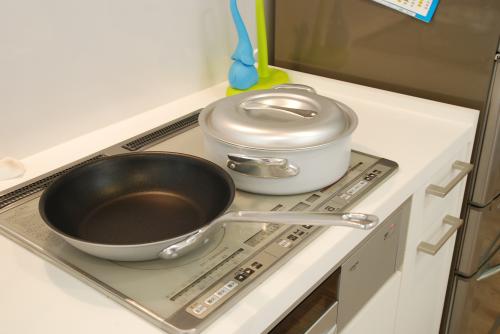
This screenshot has width=500, height=334. Identify the location of corner of a calendar hanging on refrigerator. (408, 8).